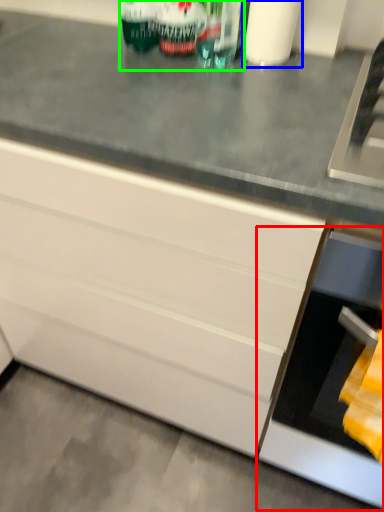
Question: Estimate the real-world distances between objects in this image. Which object is closer to oven (highlighted by a red box), toilet paper (highlighted by a blue box) or beverage (highlighted by a green box)?

Choices:
 (A) toilet paper
 (B) beverage

Answer: (B)